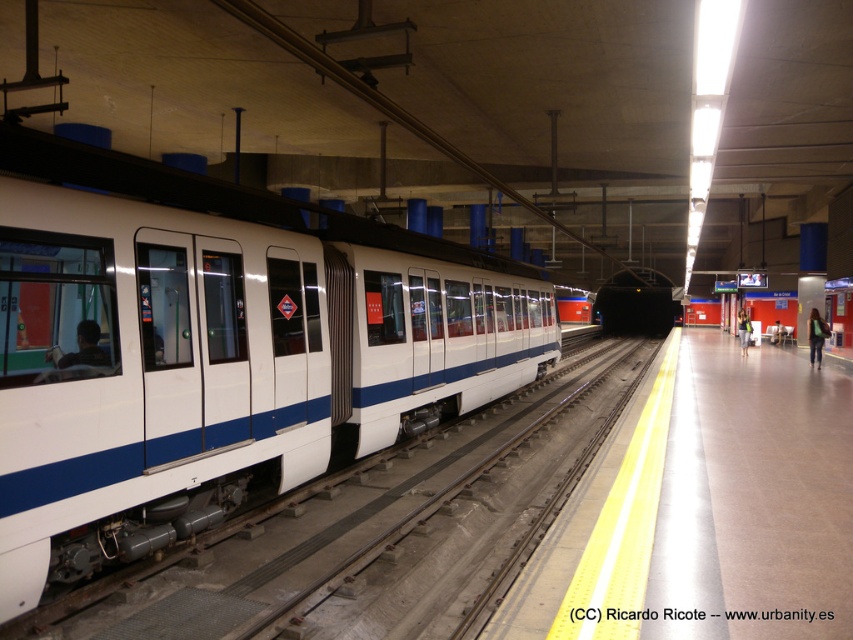
You are standing on the subway platform and want to board the white glossy train at left. The safety distance required between you and the edge of the platform is 1.5 meters. If you are currently 1.2 meters away from the edge, can you safely walk towards the train without violating the safety rule?

The white glossy train at left is 4.40 meters away from the viewer. Since you are already 1.2 meters away from the edge, which is within the required 1.5 meters safety distance, you can safely walk towards the train as long as you maintain at least 1.5 meters distance from the edge. However, the total distance to the train is 4.40 meters, so you need to ensure your path stays within the safety zone.

Consider the image. You are standing at the subway station platform and notice a green fabric bag at right. Based on its coordinates, is it closer to the train or the edge of the platform?

The green fabric bag at right is located at coordinates point (816, 337). Since the platform edge is marked by the yellow tactile paving strip at the lower edge closest to the tracks, the bag is closer to the edge of the platform than the train.

You are a passenger waiting at the subway station platform. You notice a white glossy train at left and a denim jacket at right. Which object is closer to the edge of the platform with the yellow tactile paving strip?

The denim jacket at right is closer to the edge of the platform with the yellow tactile paving strip because the white glossy train at left is positioned over it, meaning the jacket is further away from the train and closer to the edge.